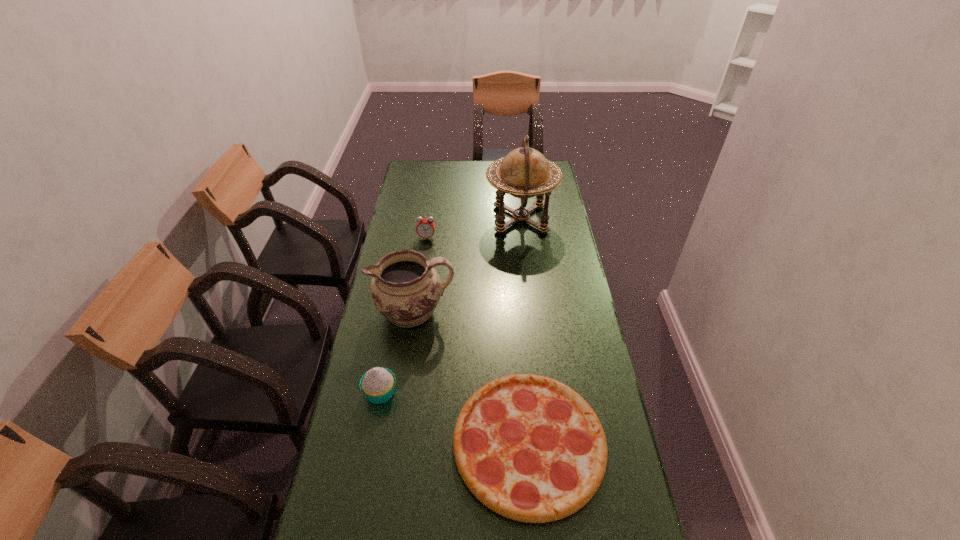
Where is `vacant space that satisfies the following two spatial constraints: 1. on the front-facing side of the alarm clock; 2. on the right side of the shortest object`? The width and height of the screenshot is (960, 540). vacant space that satisfies the following two spatial constraints: 1. on the front-facing side of the alarm clock; 2. on the right side of the shortest object is located at coordinates (397, 443).

The width and height of the screenshot is (960, 540). Identify the location of free region that satisfies the following two spatial constraints: 1. on the front-facing side of the tallest object; 2. on the front-facing side of the alarm clock. (523, 238).

This screenshot has width=960, height=540. I want to click on vacant area in the image that satisfies the following two spatial constraints: 1. on the spout of the shortest object; 2. on the left side of the fourth shortest object, so click(395, 443).

Image resolution: width=960 pixels, height=540 pixels. I want to click on free point that satisfies the following two spatial constraints: 1. on the front-facing side of the alarm clock; 2. on the left side of the pizza, so click(x=397, y=443).